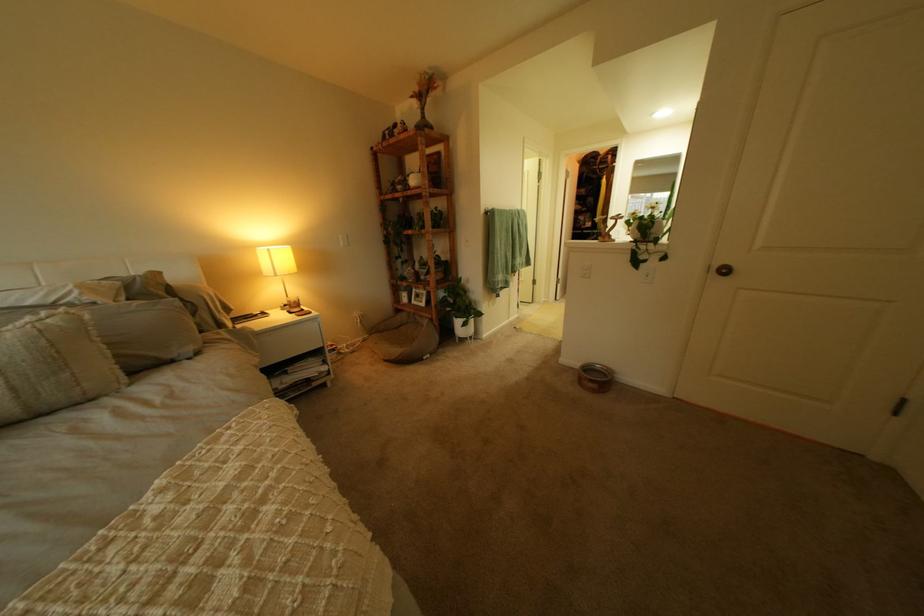
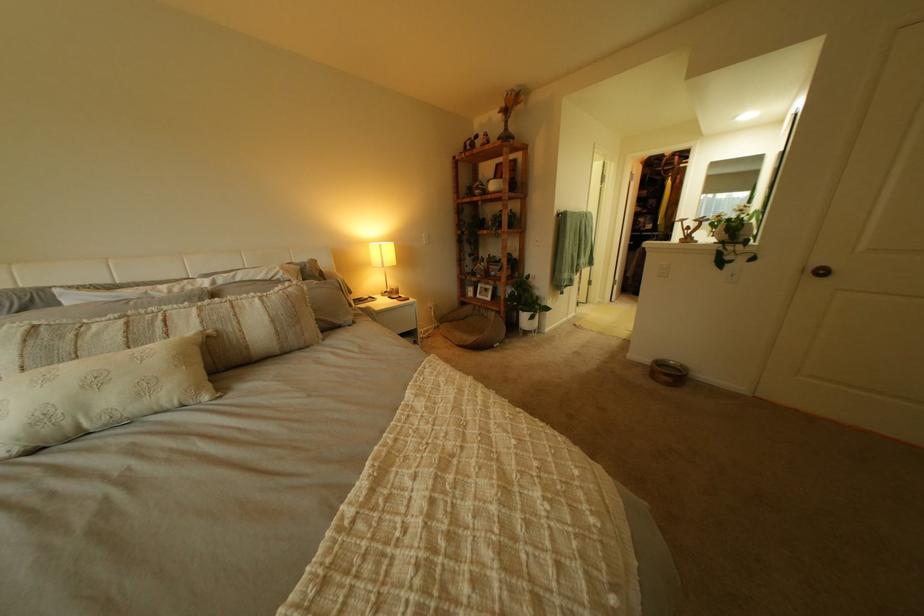
Locate, in the second image, the point that corresponds to point (450, 321) in the first image.

(517, 314)